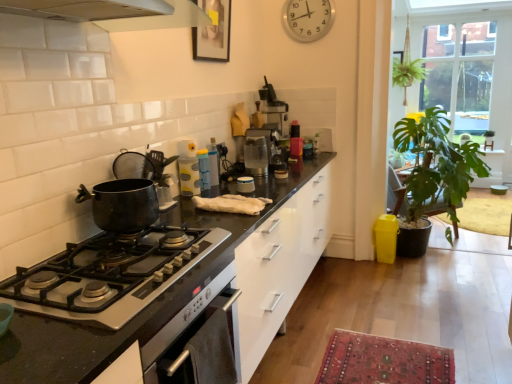
Question: In the image, is silver metallic clock at upper center positioned in front of or behind clear glass coffee machine at center?

Choices:
 (A) front
 (B) behind

Answer: (B)

Question: Is point (307, 26) closer or farther from the camera than point (262, 134)?

Choices:
 (A) closer
 (B) farther

Answer: (B)

Question: Which is farther from the clear glass window at upper right?

Choices:
 (A) wooden picture frame at upper center
 (B) translucent plastic spray bottle at center, which ranks as the 1th appliance in left-to-right order
 (C) clear glass coffee machine at center
 (D) green leafy plant at right
 (E) white plastic container at center, the second appliance viewed from the front

Answer: (B)

Question: Considering the real-world distances, which object is farthest from the silver metallic clock at upper center?

Choices:
 (A) white plastic container at center, the second appliance viewed from the front
 (B) metallic coffee machine at upper center, placed as the 4th appliance when sorted from left to right
 (C) translucent plastic spray bottle at center, which is counted as the 2th appliance, starting from the bottom
 (D) black matte gas stove at lower left
 (E) matte black pot at left

Answer: (D)